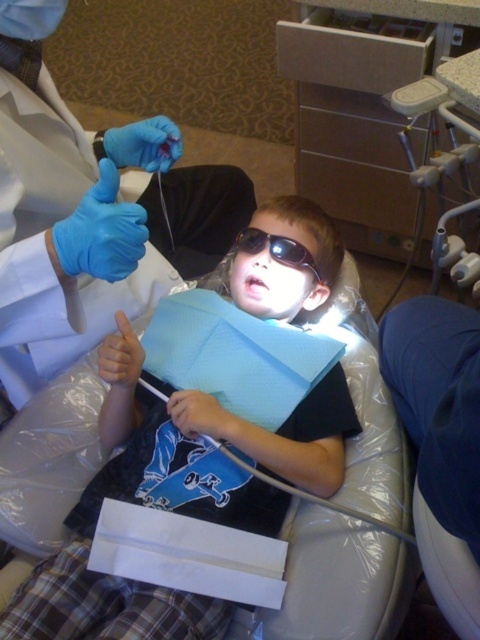
Which is above, matte black shirt at center or smooth skin mouth at center?

smooth skin mouth at center is higher up.

Who is positioned more to the right, matte black shirt at center or smooth skin mouth at center?

Positioned to the right is smooth skin mouth at center.

Locate an element on the screen. The height and width of the screenshot is (640, 480). matte black shirt at center is located at coordinates (175, 499).

Can you confirm if black plastic goggles at center is positioned to the right of smooth skin mouth at center?

Correct, you'll find black plastic goggles at center to the right of smooth skin mouth at center.

Can you confirm if black plastic goggles at center is bigger than smooth skin mouth at center?

Yes, black plastic goggles at center is bigger than smooth skin mouth at center.

The image size is (480, 640). I want to click on black plastic goggles at center, so click(x=276, y=248).

Where is `black plastic goggles at center`? Image resolution: width=480 pixels, height=640 pixels. black plastic goggles at center is located at coordinates (276, 248).

Can you confirm if blue latex gloves at upper left is smaller than black plastic goggles at center?

No.

Does point (11, 317) come closer to viewer compared to point (292, 244)?

That is True.

This screenshot has width=480, height=640. Identify the location of blue latex gloves at upper left. (90, 212).

The image size is (480, 640). I want to click on blue latex gloves at upper left, so click(x=90, y=212).